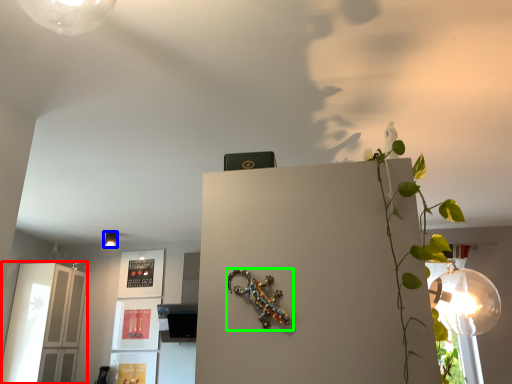
Question: Which object is the farthest from glass door (highlighted by a red box)? Choose among these: lamp (highlighted by a blue box) or lizard (highlighted by a green box).

Choices:
 (A) lamp
 (B) lizard

Answer: (B)